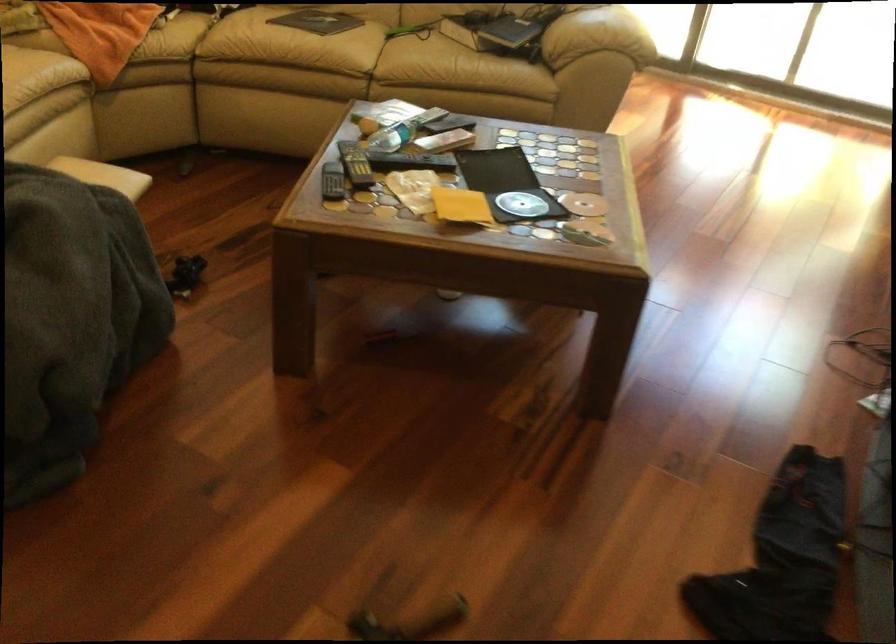
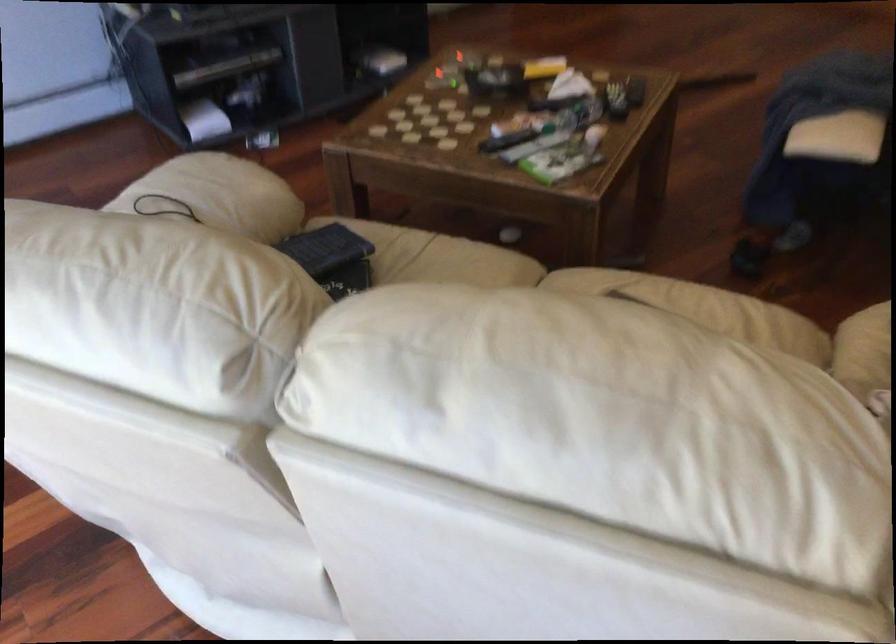
In the second image, find the point that corresponds to point 445,120 in the first image.

(506, 140)